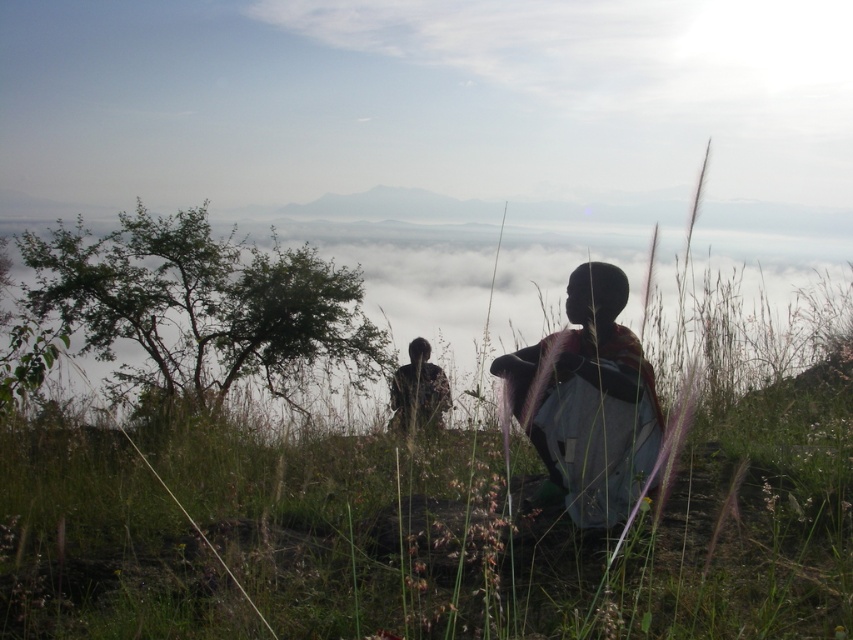
Question: Does silhouette fabric at center appear under dark brown leather jacket at center?

Choices:
 (A) yes
 (B) no

Answer: (B)

Question: Is silhouette fabric at center thinner than dark brown leather jacket at center?

Choices:
 (A) yes
 (B) no

Answer: (B)

Question: Does silhouette fabric at center appear on the right side of dark brown leather jacket at center?

Choices:
 (A) no
 (B) yes

Answer: (B)

Question: Which object appears farthest from the camera in this image?

Choices:
 (A) dark brown leather jacket at center
 (B) silhouette fabric at center

Answer: (A)